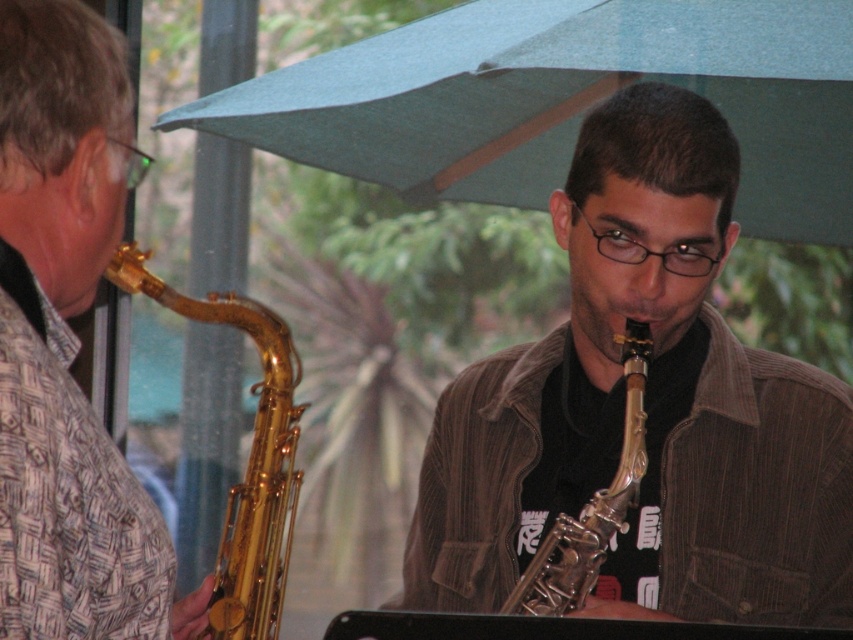
You are a photographer trying to capture a closeup shot of both the shiny silver saxophone at center and the matte gold saxophone at left. Given that your camera can only focus on objects within a 18 inch range, will you be able to get both saxophones in focus?

The shiny silver saxophone at center and the matte gold saxophone at left are 19.08 inches apart from each other, which is slightly beyond the camera focus range of 18 inches. Therefore, both saxophones cannot be in focus simultaneously.

You are a photographer trying to capture a photo of the gold shiny saxophone at center and the green fabric umbrella at upper center. You want to ensure both are in frame. Based on their positions, which object should you adjust your camera to focus on first to include both in the shot?

The green fabric umbrella at upper center is to the left of the gold shiny saxophone at center. To include both in the shot, focus on the gold shiny saxophone at center first as it is centrally located, ensuring the umbrella at upper left is within the frame.

You are standing in the park and see the two saxophonists under the teal umbrella. There is a point at coordinates (566, 100). Which object from the scene does this point belong to?

The point at coordinates (566, 100) belongs to the green fabric umbrella at upper center.